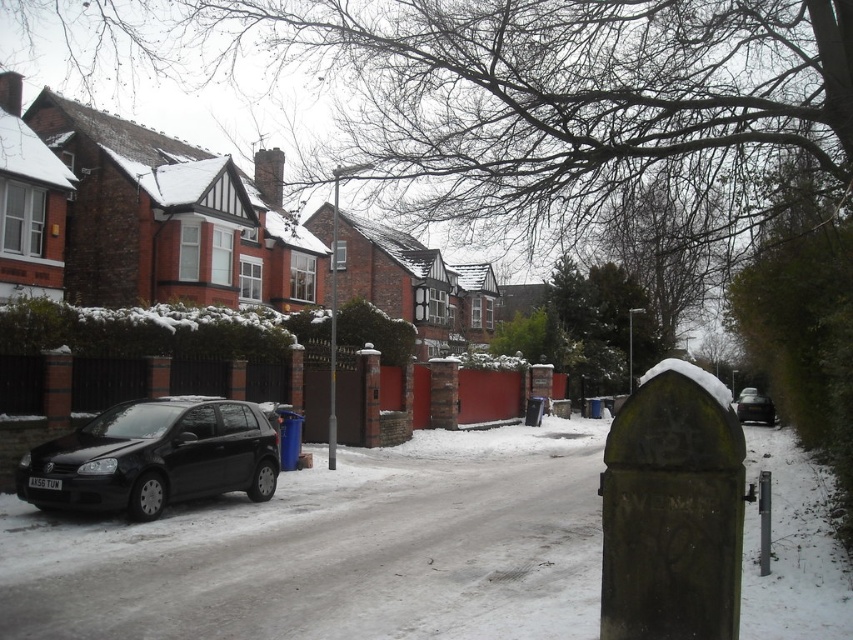
Can you confirm if matte black car at lower left is taller than black matte car at right?

Indeed, matte black car at lower left has a greater height compared to black matte car at right.

Does matte black car at lower left appear under black matte car at right?

Incorrect, matte black car at lower left is not positioned below black matte car at right.

Which is behind, point (212, 484) or point (738, 408)?

The point (738, 408) is more distant.

Locate an element on the screen. The image size is (853, 640). matte black car at lower left is located at coordinates (154, 458).